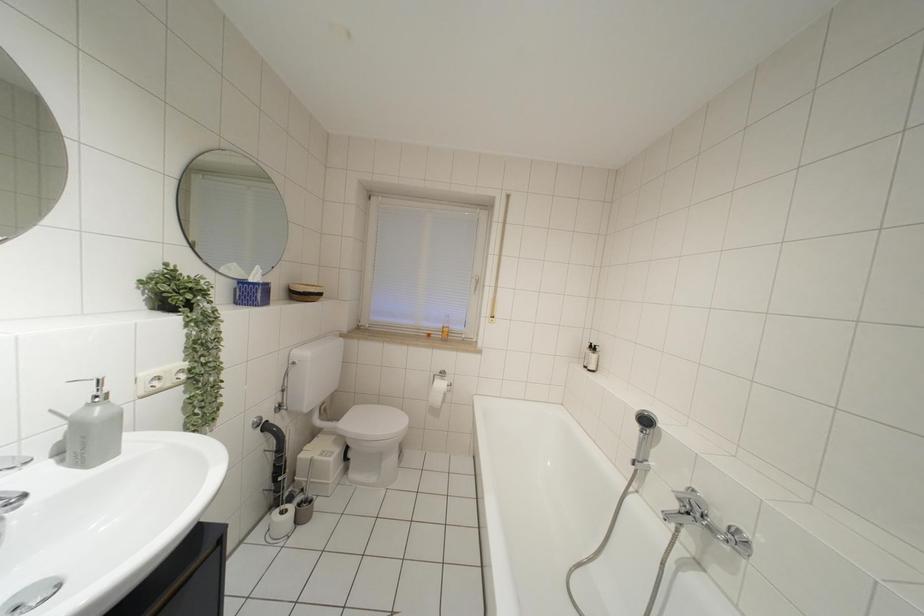
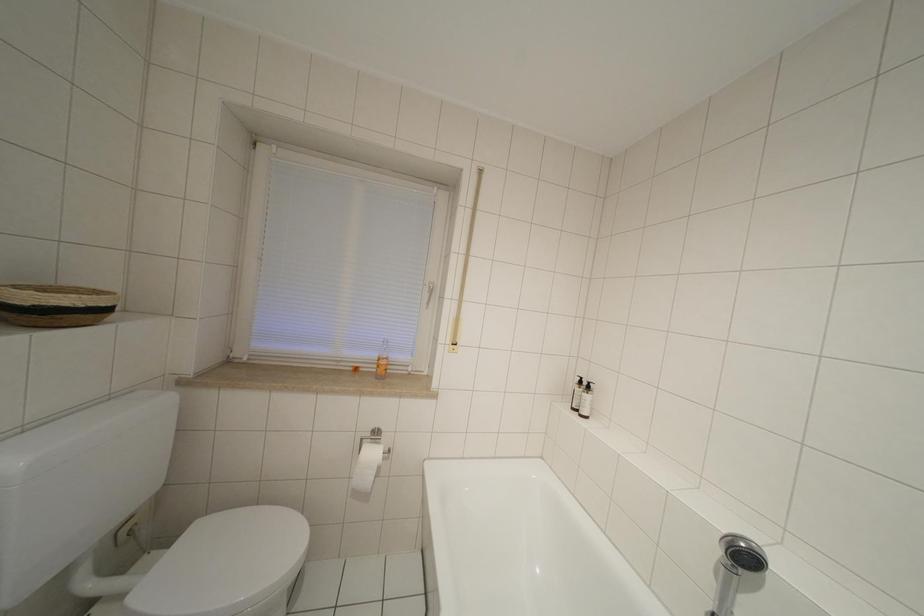
Question: In a continuous first-person perspective shot, in which direction is the camera moving?

Choices:
 (A) Left
 (B) Right
 (C) Forward
 (D) Backward

Answer: (C)